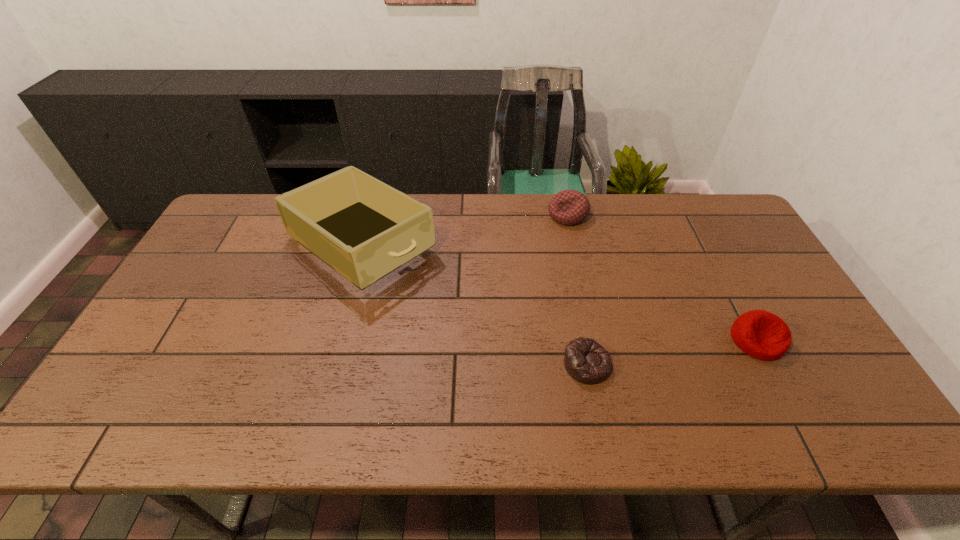
Locate which beanbag is the closest to the shortest beanbag. Please provide its 2D coordinates. Your answer should be formatted as a tuple, i.e. [(x, y)], where the tuple contains the x and y coordinates of a point satisfying the conditions above.

[(760, 334)]

Locate an element on the screen. beanbag identified as the second closest to the shortest object is located at coordinates (569, 207).

At what (x,y) coordinates should I click in order to perform the action: click on free space in the image that satisfies the following two spatial constraints: 1. on the back side of the box; 2. on the left side of the farthest beanbag. Please return your answer as a coordinate pair (x, y). Looking at the image, I should click on (370, 215).